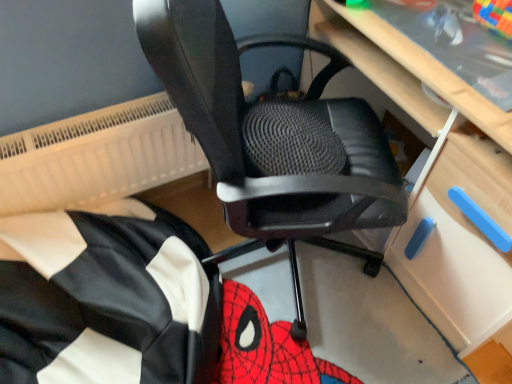
Question: Is black mesh office chair at center in front of or behind black fabric bean bag at lower left in the image?

Choices:
 (A) behind
 (B) front

Answer: (B)

Question: Based on their sizes in the image, would you say black mesh office chair at center is bigger or smaller than black fabric bean bag at lower left?

Choices:
 (A) small
 (B) big

Answer: (B)

Question: Considering the real-world distances, which object is closest to the black fabric bean bag at lower left?

Choices:
 (A) light wood computer desk at center
 (B) white textured radiator at upper left
 (C) black mesh office chair at center

Answer: (B)

Question: Estimate the real-world distances between objects in this image. Which object is farther from the white textured radiator at upper left?

Choices:
 (A) black fabric bean bag at lower left
 (B) black mesh office chair at center
 (C) light wood computer desk at center

Answer: (C)